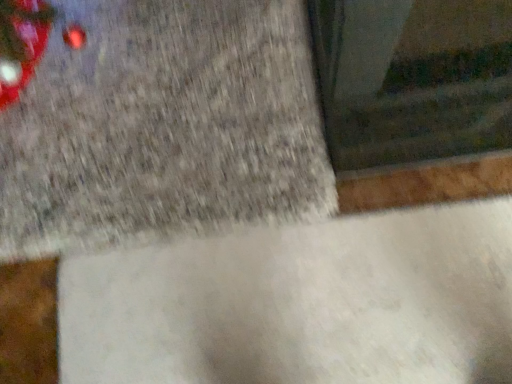
The image size is (512, 384). I want to click on free spot below white matte concrete at center, which is the first concrete from bottom to top (from a real-world perspective), so click(x=286, y=303).